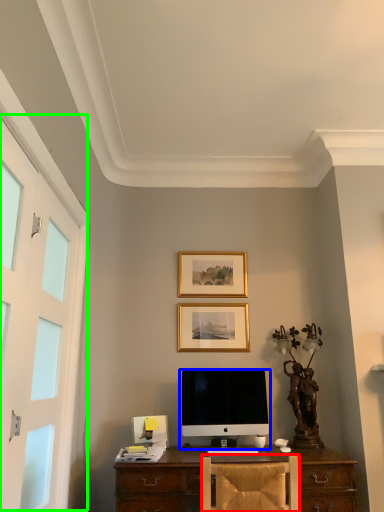
Question: Estimate the real-world distances between objects in this image. Which object is closer to chair (highlighted by a red box), computer monitor (highlighted by a blue box) or screen door (highlighted by a green box)?

Choices:
 (A) computer monitor
 (B) screen door

Answer: (A)